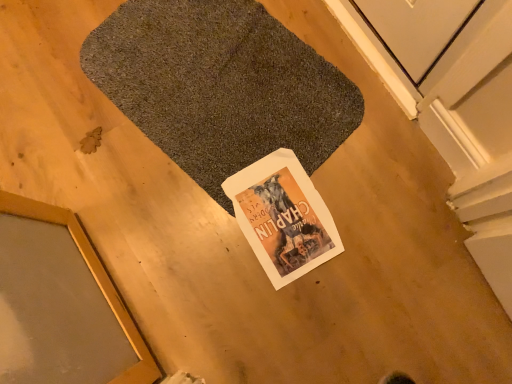
Question: Is gold-framed mirror at lower left wider or thinner than white paper magazine at center?

Choices:
 (A) wide
 (B) thin

Answer: (A)

Question: In terms of size, does gold-framed mirror at lower left appear bigger or smaller than white paper magazine at center?

Choices:
 (A) small
 (B) big

Answer: (B)

Question: Which object is the closest to the white paper magazine at center?

Choices:
 (A) gold-framed mirror at lower left
 (B) dark gray carpet at center

Answer: (B)

Question: Estimate the real-world distances between objects in this image. Which object is closer to the gold-framed mirror at lower left?

Choices:
 (A) white paper magazine at center
 (B) dark gray carpet at center

Answer: (A)